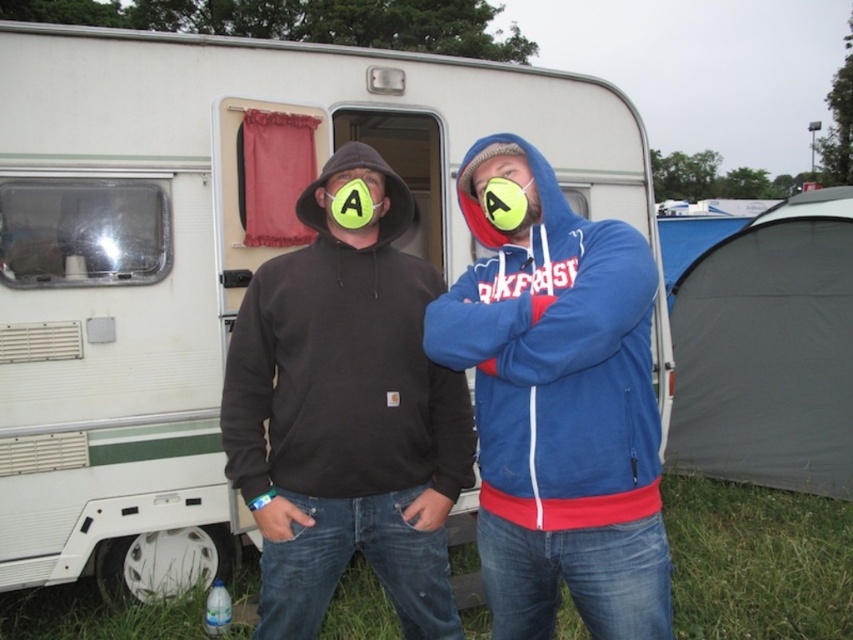
You are a photographer trying to capture both the blue fleece jacket at center and the matte black hoodie at center in a single frame. Given their height difference, which one should you focus on to ensure both are fully visible in the photo?

The blue fleece jacket at center is much taller than the matte black hoodie at center, so focusing on the blue fleece jacket at center will ensure both are fully visible in the photo.

You are planning to set up a tent in the grassy area near the caravan. There is a dark gray fabric tent at right. Can you determine its exact location coordinates relative to the caravan?

The dark gray fabric tent at right is located at point coordinates of (769, 349).

You are standing in front of the white caravan with green stripes and need to locate the blue fleece jacket at center. According to the coordinates provided, where exactly should you look to find it?

The blue fleece jacket at center is located at point coordinates 0.647 on the x axis and 0.658 on the y axis.